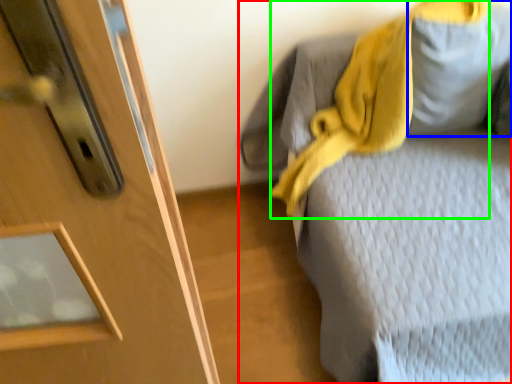
Question: Considering the real-world distances, which object is farthest from furniture (highlighted by a red box)? gray (highlighted by a blue box) or scarf (highlighted by a green box)?

Choices:
 (A) gray
 (B) scarf

Answer: (A)